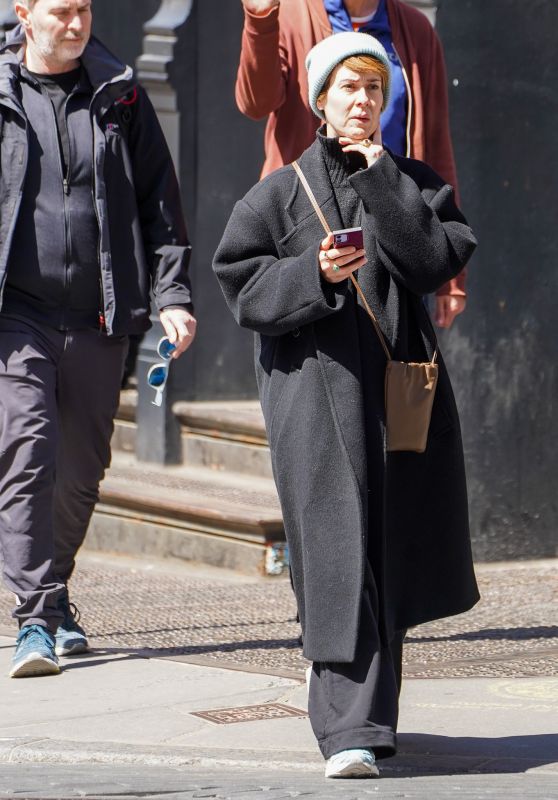
This screenshot has height=800, width=558. Identify the location of phone. (344, 233).